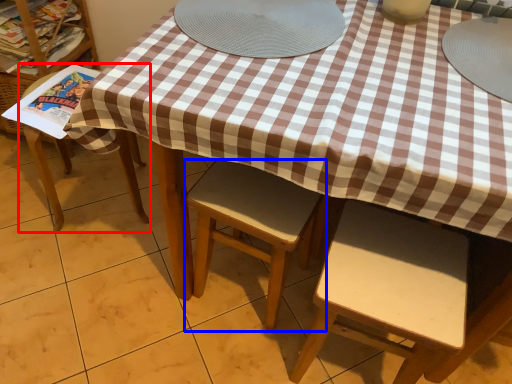
Question: Which of the following is the farthest to the observer, chair (highlighted by a red box) or chair (highlighted by a blue box)?

Choices:
 (A) chair
 (B) chair

Answer: (A)